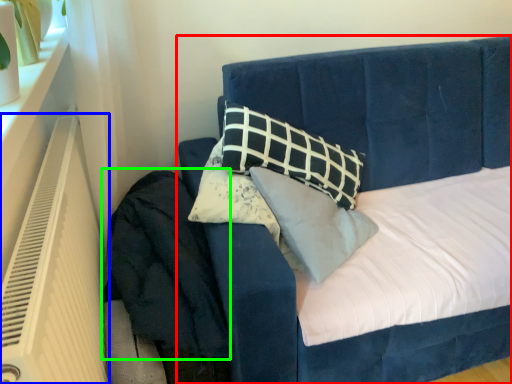
Question: Which object is positioned farthest from bed (highlighted by a red box)? Select from heater (highlighted by a blue box) and velvet (highlighted by a green box).

Choices:
 (A) heater
 (B) velvet

Answer: (A)